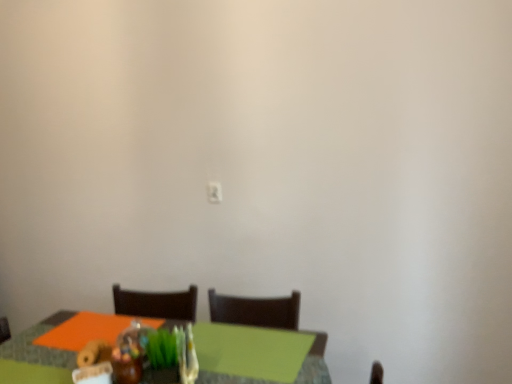
Describe the element at coordinates (38, 346) in the screenshot. Image resolution: width=512 pixels, height=384 pixels. I see `green fabric table at lower center` at that location.

This screenshot has width=512, height=384. Find the location of `green fabric table at lower center`. green fabric table at lower center is located at coordinates (x=38, y=346).

This screenshot has width=512, height=384. Find the location of `green fabric table at lower center`. green fabric table at lower center is located at coordinates (38, 346).